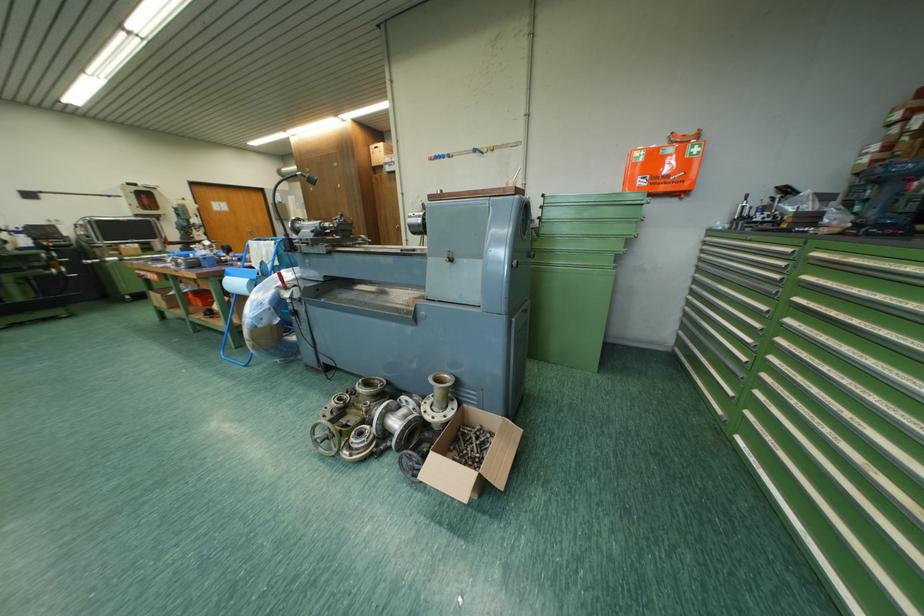
The width and height of the screenshot is (924, 616). Find the location of `small metal handwheel`. small metal handwheel is located at coordinates (338, 424).